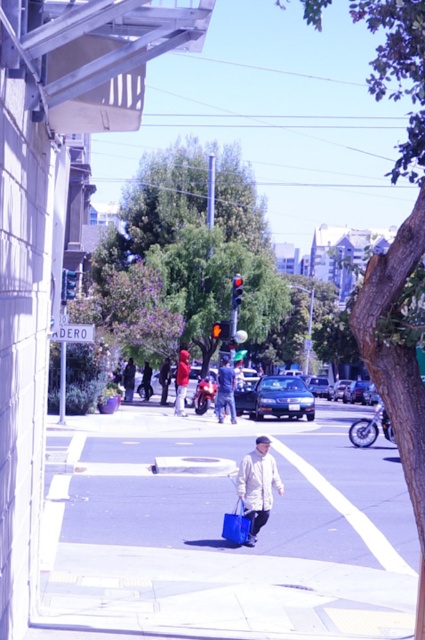
You are standing at the point with coordinates point (240, 588) and want to walk to point (227, 362). Which direction should you turn to face the direction of your destination?

You should turn to face the left direction because point (227, 362) is further away from the camera compared to point (240, 588), meaning it is located to the left side of the frame.

You are a delivery person standing on the smooth concrete sidewalk at center. You see a denim jacket at center. Where is the denim jacket located relative to the sidewalk?

The denim jacket at center is above the smooth concrete sidewalk at center since the sidewalk is positioned under it.